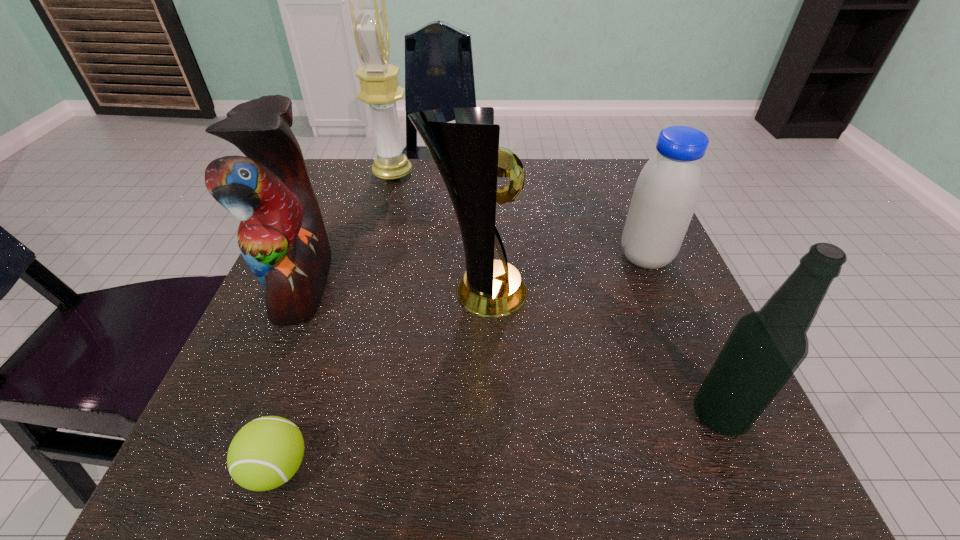
Identify the location of vacant space situated 0.150m at the face of the parrot. (414, 283).

Where is `free location located 0.270m on the left of the alcohol`? free location located 0.270m on the left of the alcohol is located at coordinates (494, 416).

Find the location of a particular element. This screenshot has height=540, width=960. free space located 0.120m on the left of the soya milk is located at coordinates (555, 258).

At what (x,y) coordinates should I click in order to perform the action: click on free spot located 0.310m on the back of the shortest object. Please return your answer as a coordinate pair (x, y). Looking at the image, I should click on (342, 276).

Where is `object located in the far edge section of the desktop`? This screenshot has height=540, width=960. object located in the far edge section of the desktop is located at coordinates (380, 89).

The height and width of the screenshot is (540, 960). I want to click on alcohol situated at the near edge, so click(x=766, y=347).

This screenshot has height=540, width=960. I want to click on tennis ball that is at the near edge, so (x=265, y=453).

Identify the location of award that is at the left edge. (380, 89).

The image size is (960, 540). In order to click on parrot that is at the left edge in this screenshot , I will do `click(282, 238)`.

What are the coordinates of `tennis ball that is at the left edge` in the screenshot? It's located at (265, 453).